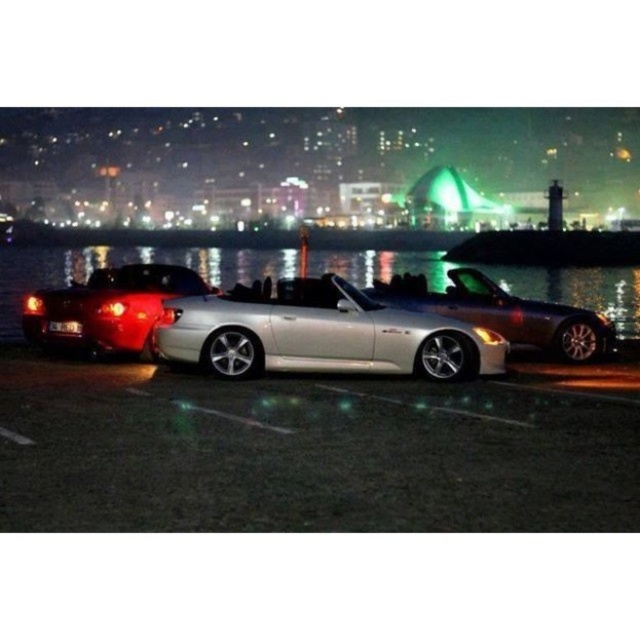
Is silver metallic convertible at center wider than shiny red convertible at left?

Yes, silver metallic convertible at center is wider than shiny red convertible at left.

Can you confirm if silver metallic convertible at center is positioned to the left of shiny red convertible at left?

Incorrect, silver metallic convertible at center is not on the left side of shiny red convertible at left.

Locate an element on the screen. silver metallic convertible at center is located at coordinates (321, 333).

The image size is (640, 640). I want to click on silver metallic convertible at center, so click(x=321, y=333).

Find the location of a particular element. The image size is (640, 640). shiny metallic car at center is located at coordinates (314, 451).

Which of these two, shiny metallic car at center or glossy reflective water at center, stands shorter?

With less height is glossy reflective water at center.

You are a GUI agent. You are given a task and a screenshot of the screen. Output one action in this format:
    pyautogui.click(x=<x>, y=<y>)
    Task: Click on the shiny metallic car at center
    
    Given the screenshot: What is the action you would take?
    (314, 451)

This screenshot has width=640, height=640. In order to click on shiny metallic car at center in this screenshot , I will do `click(314, 451)`.

Between shiny metallic car at center and silver metallic convertible at center, which one is positioned lower?

Positioned lower is silver metallic convertible at center.

Does shiny metallic car at center have a smaller size compared to silver metallic convertible at center?

Incorrect, shiny metallic car at center is not smaller in size than silver metallic convertible at center.

Who is more distant from viewer, (x=170, y=483) or (x=184, y=344)?

The point (x=184, y=344) is behind.

The height and width of the screenshot is (640, 640). Identify the location of shiny metallic car at center. (314, 451).